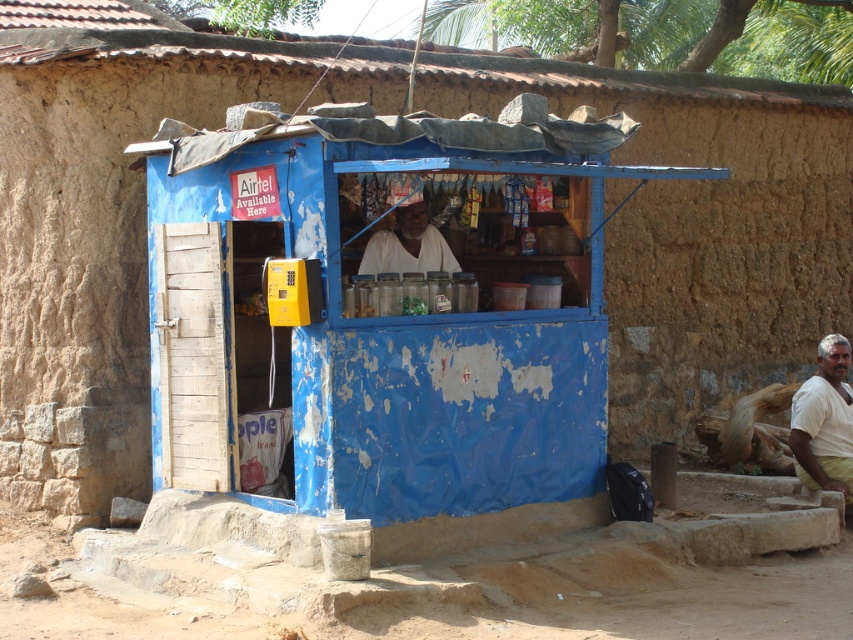
Question: In this image, where is white cotton shirt at lower right located relative to white matte man at center?

Choices:
 (A) below
 (B) above

Answer: (A)

Question: Which point is closer to the camera?

Choices:
 (A) (387, 260)
 (B) (817, 410)

Answer: (A)

Question: Which point appears farthest from the camera in this image?

Choices:
 (A) (370, 269)
 (B) (824, 424)

Answer: (B)

Question: Can you confirm if white cotton shirt at lower right is positioned to the left of white matte man at center?

Choices:
 (A) yes
 (B) no

Answer: (B)

Question: Which point appears closest to the camera in this image?

Choices:
 (A) (384, 234)
 (B) (798, 424)

Answer: (A)

Question: Is white cotton shirt at lower right bigger than white matte man at center?

Choices:
 (A) yes
 (B) no

Answer: (A)